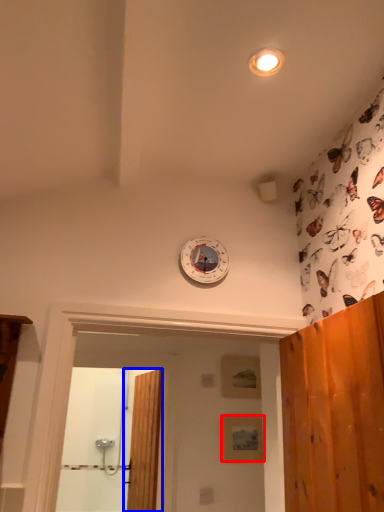
Question: Among these objects, which one is farthest to the camera, panel (highlighted by a red box) or door (highlighted by a blue box)?

Choices:
 (A) panel
 (B) door

Answer: (A)